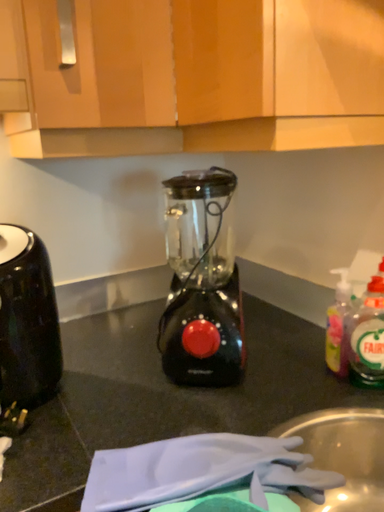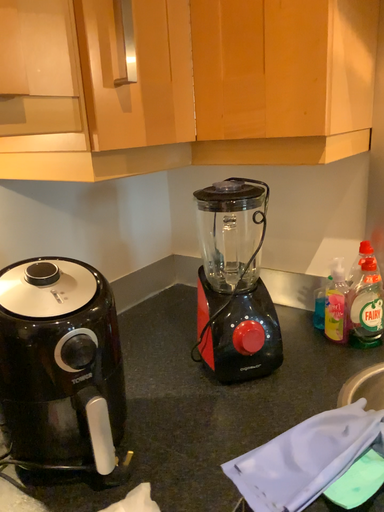
Question: Which way did the camera rotate in the video?

Choices:
 (A) rotated left
 (B) rotated right

Answer: (B)